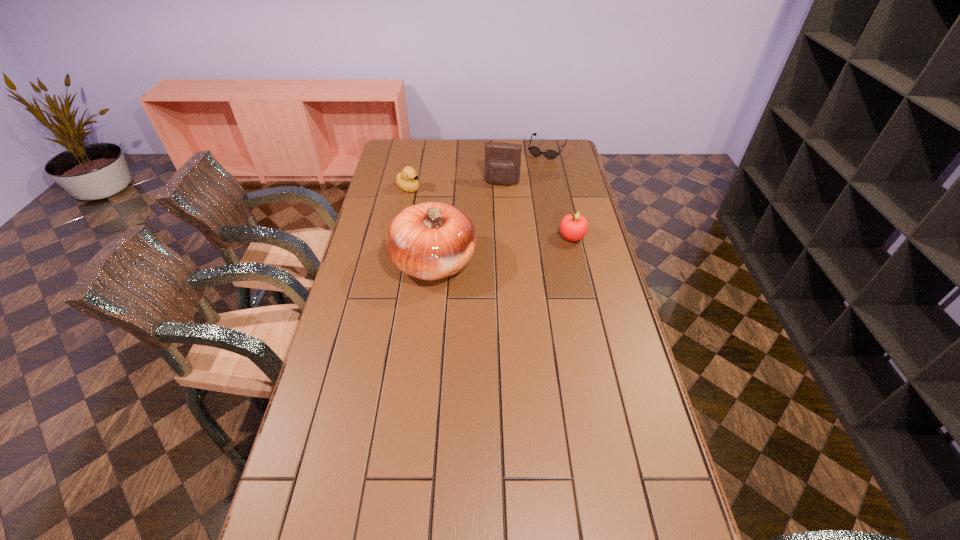
The image size is (960, 540). What are the coordinates of `free space at the far right corner` in the screenshot? It's located at (553, 161).

Find the location of a particular element. empty space that is in between the pouch and the duckling is located at coordinates (455, 186).

The width and height of the screenshot is (960, 540). Identify the location of empty space that is in between the sunglasses and the pumpkin. (491, 206).

Locate an element on the screen. The height and width of the screenshot is (540, 960). empty space between the duckling and the shortest object is located at coordinates (478, 169).

Find the location of a particular element. vacant region between the farthest object and the third object from right to left is located at coordinates (524, 166).

In order to click on empty space between the duckling and the third object from left to right in this screenshot , I will do `click(455, 186)`.

Locate an element on the screen. The image size is (960, 540). free space between the duckling and the fourth shortest object is located at coordinates (455, 186).

Where is `unoccupied area between the fourth shortest object and the apple`? unoccupied area between the fourth shortest object and the apple is located at coordinates (537, 210).

Where is `empty space that is in between the apple and the third object from right to left`? empty space that is in between the apple and the third object from right to left is located at coordinates (537, 210).

Locate which object is the third closest to the farthest object. Please provide its 2D coordinates. Your answer should be formatted as a tuple, i.e. [(x, y)], where the tuple contains the x and y coordinates of a point satisfying the conditions above.

[(406, 180)]